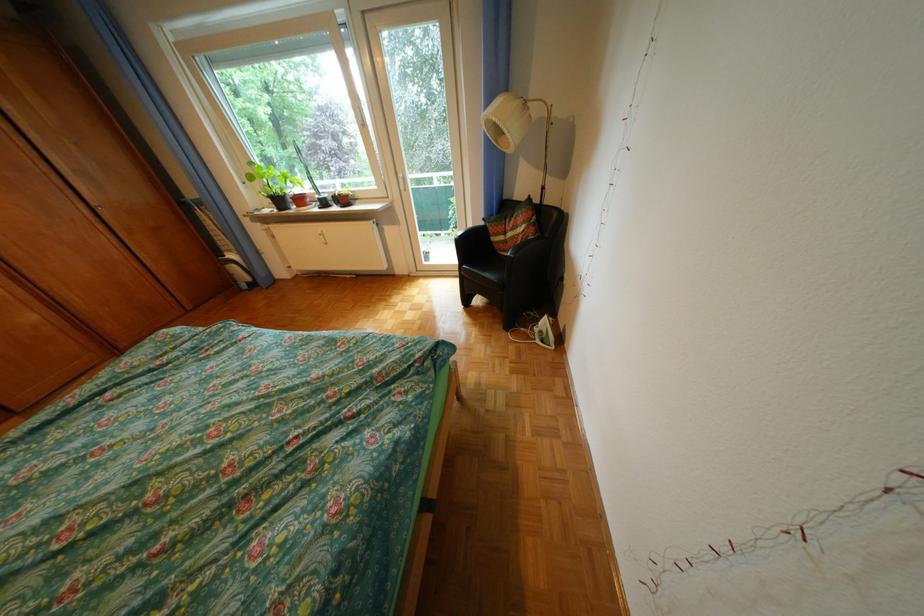
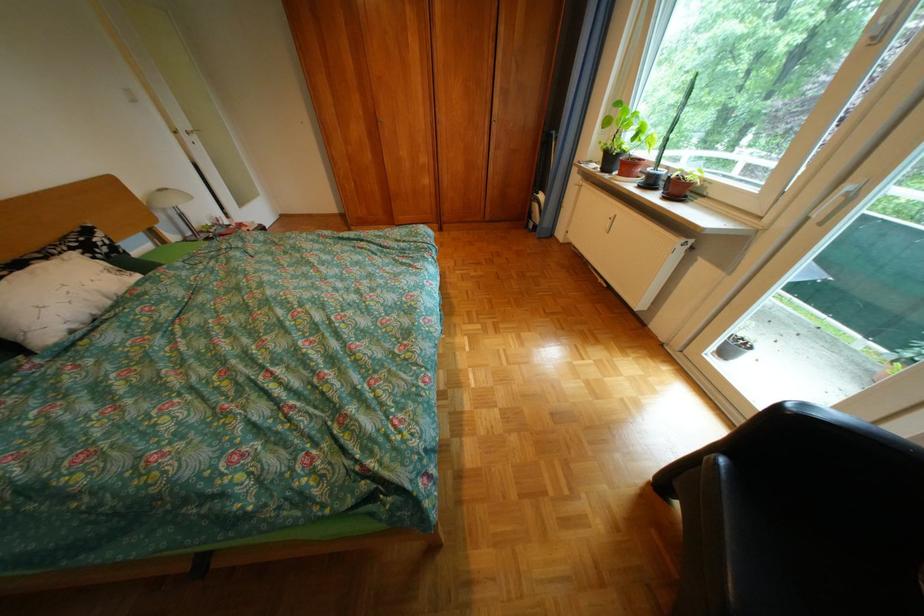
The first image is from the beginning of the video and the second image is from the end. How did the camera likely rotate when shooting the video?

The camera's rotation is toward left-down.